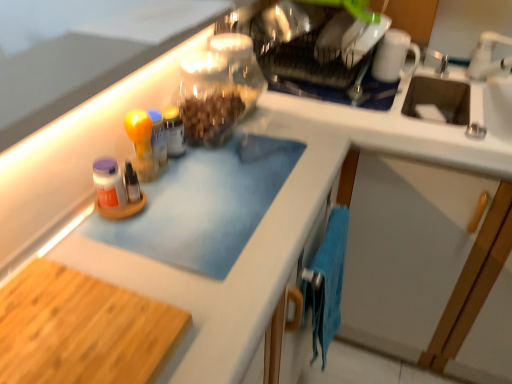
You are a GUI agent. You are given a task and a screenshot of the screen. Output one action in this format:
    pyautogui.click(x=<x>, y=<y>)
    Task: Click on the free space to the left of white ceramic faucet at upper right
    The width and height of the screenshot is (512, 384).
    Given the screenshot: What is the action you would take?
    pyautogui.click(x=455, y=82)